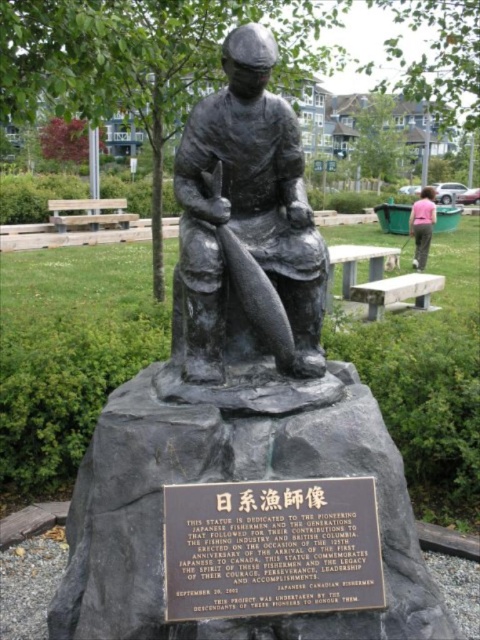
Question: Considering the relative positions of bronze statue of fisherman at center and pink fabric pants at lower right in the image provided, where is bronze statue of fisherman at center located with respect to pink fabric pants at lower right?

Choices:
 (A) below
 (B) above

Answer: (A)

Question: Is bronze statue of fisherman at center to the right of bronze plaque at center from the viewer's perspective?

Choices:
 (A) yes
 (B) no

Answer: (B)

Question: Which point is farther from the camera taking this photo?

Choices:
 (A) (235, 330)
 (B) (250, 547)
 (C) (416, 266)

Answer: (C)

Question: Estimate the real-world distances between objects in this image. Which object is closer to the bronze plaque at center?

Choices:
 (A) bronze statue of fisherman at center
 (B) pink fabric pants at lower right

Answer: (A)

Question: Does bronze statue of fisherman at center come in front of bronze plaque at center?

Choices:
 (A) no
 (B) yes

Answer: (A)

Question: Considering the real-world distances, which object is farthest from the pink fabric pants at lower right?

Choices:
 (A) bronze statue of fisherman at center
 (B) bronze plaque at center

Answer: (B)